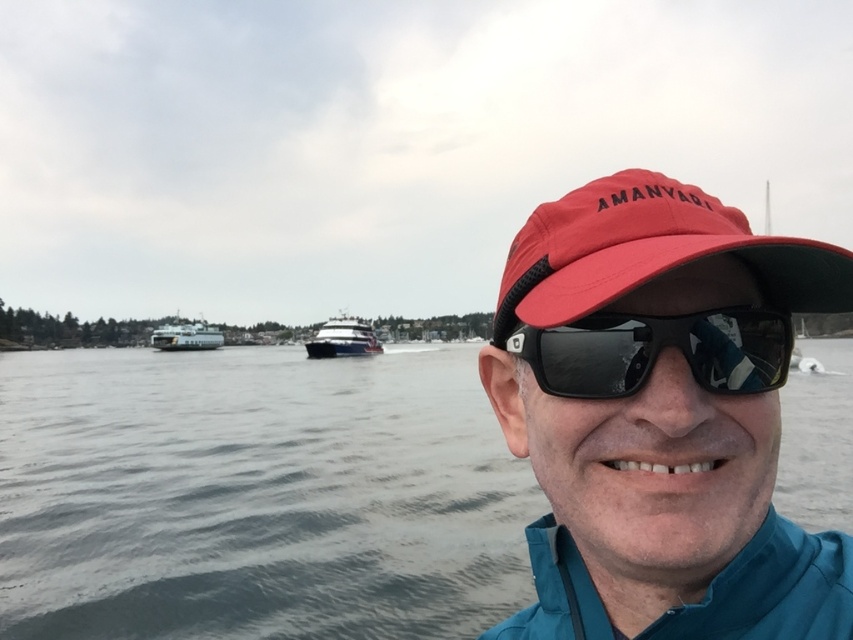
Looking at this image, is matte red cap at center to the right of shiny blue yacht at center from the viewer's perspective?

Indeed, matte red cap at center is positioned on the right side of shiny blue yacht at center.

Does matte red cap at center appear on the left side of shiny blue yacht at center?

In fact, matte red cap at center is to the right of shiny blue yacht at center.

Does point (672, 289) come farther from viewer compared to point (363, 340)?

No.

This screenshot has height=640, width=853. Find the location of `matte red cap at center`. matte red cap at center is located at coordinates (660, 417).

Which is in front, point (619, 444) or point (167, 332)?

Point (619, 444) is in front.

Describe the element at coordinates (660, 417) in the screenshot. I see `matte red cap at center` at that location.

Which is behind, point (611, 500) or point (195, 349)?

The point (195, 349) is more distant.

This screenshot has height=640, width=853. Identify the location of matte red cap at center. (660, 417).

Does matte red cap at center appear on the right side of red fabric cap at center?

Yes, matte red cap at center is to the right of red fabric cap at center.

Who is more distant from viewer, (587, 288) or (547, 202)?

Point (547, 202)

You are a GUI agent. You are given a task and a screenshot of the screen. Output one action in this format:
    pyautogui.click(x=<x>, y=<y>)
    Task: Click on the matte red cap at center
    The width and height of the screenshot is (853, 640).
    Given the screenshot: What is the action you would take?
    pyautogui.click(x=660, y=417)